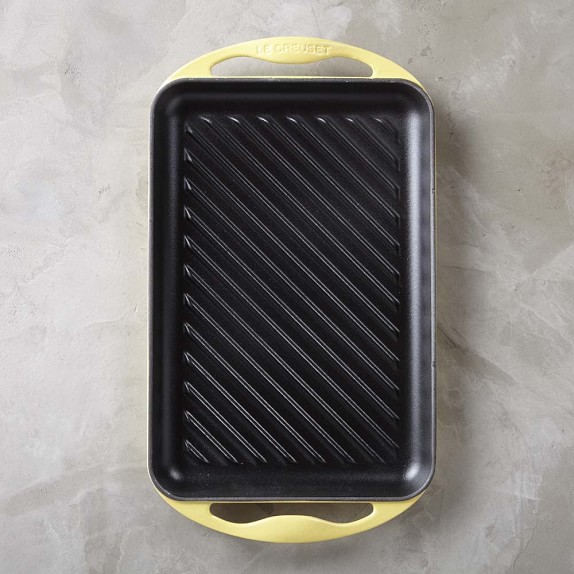
The height and width of the screenshot is (574, 574). What are the coordinates of `appliance` in the screenshot? It's located at (278, 390).